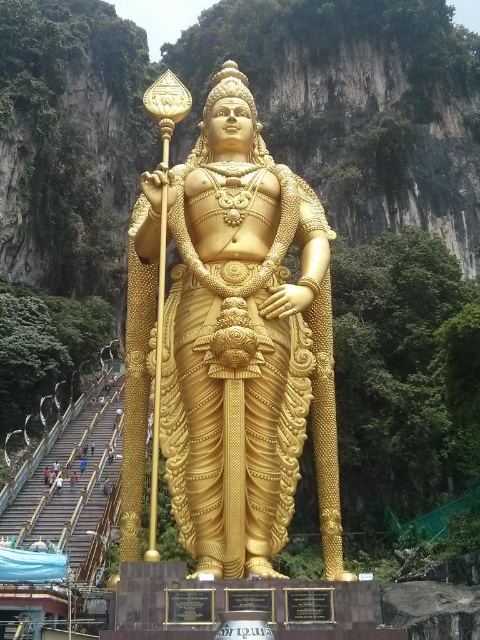
Question: Which of the following is the farthest from the observer?

Choices:
 (A) gold polished statue at center
 (B) golden statue at center

Answer: (B)

Question: Can you confirm if gold polished statue at center is positioned below golden statue at center?

Choices:
 (A) yes
 (B) no

Answer: (B)

Question: Does gold polished statue at center have a larger size compared to golden statue at center?

Choices:
 (A) yes
 (B) no

Answer: (A)

Question: Can you confirm if gold polished statue at center is bigger than golden statue at center?

Choices:
 (A) no
 (B) yes

Answer: (B)

Question: Among these points, which one is nearest to the camera?

Choices:
 (A) (219, 230)
 (B) (57, 474)

Answer: (A)